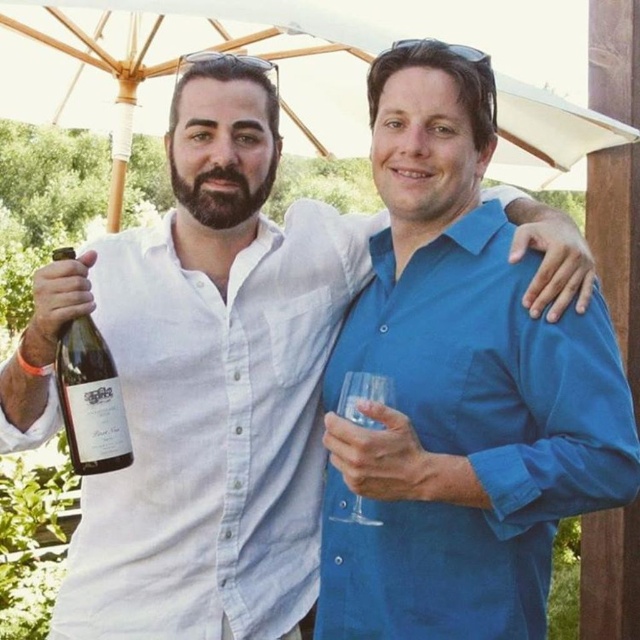
You are at a social event and want to find the blue cotton shirt at center. According to the spatial coordinates provided, where should you look relative to the image frame?

The blue cotton shirt at center is located at point 0.606 on the x axis and 0.717 on the y axis of the image frame.

You are planning to set up a small table between the white fabric umbrella at upper center and the translucent glass bottle at left for serving drinks. The table requires 2 meters of space between them to fit comfortably. Will there be enough space?

The white fabric umbrella at upper center is 2.18 meters away from the translucent glass bottle at left, so yes, there is enough space to place the table between them as the distance exceeds the required 2 meters.

You are planning to hang a small decoration from the white fabric umbrella at upper center. Considering the height of the translucent glass bottle at left, will the decoration hang below the bottle?

The white fabric umbrella at upper center is taller than the translucent glass bottle at left, so the decoration will hang above the bottle.